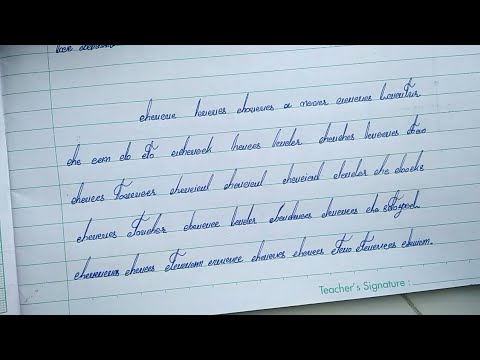
Where is `table`? This screenshot has height=360, width=480. table is located at coordinates (410, 295).